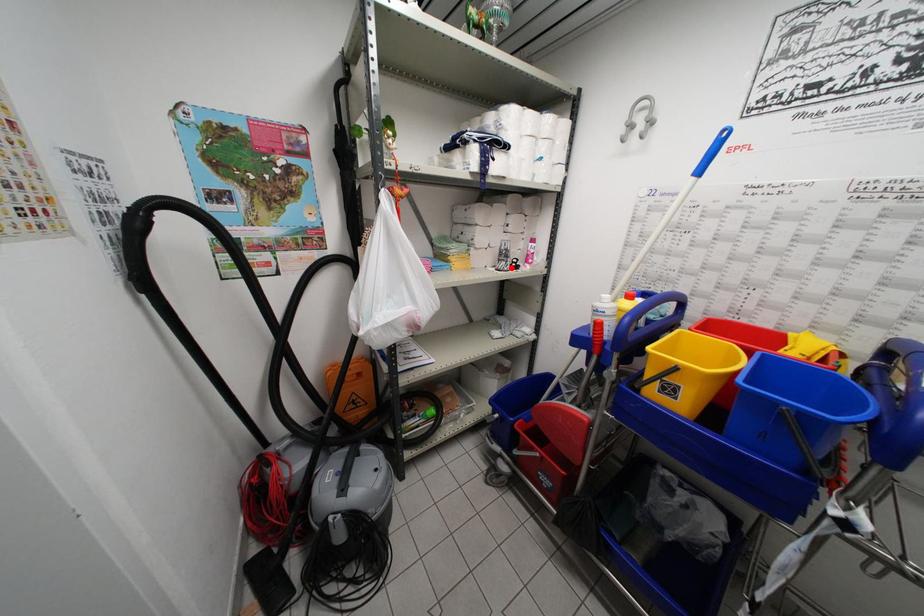
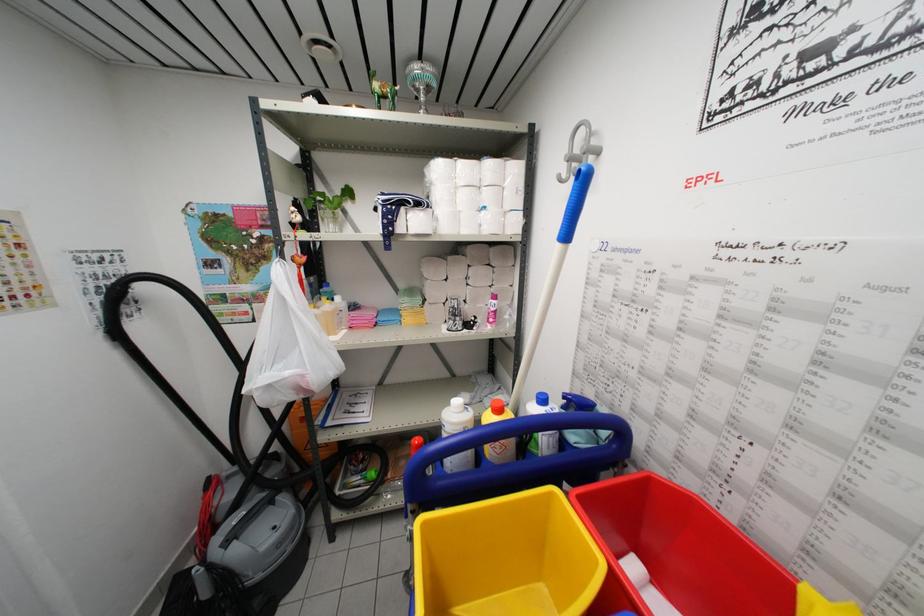
The point at the highlighted location is marked in the first image. Where is the corresponding point in the second image?

(459, 326)